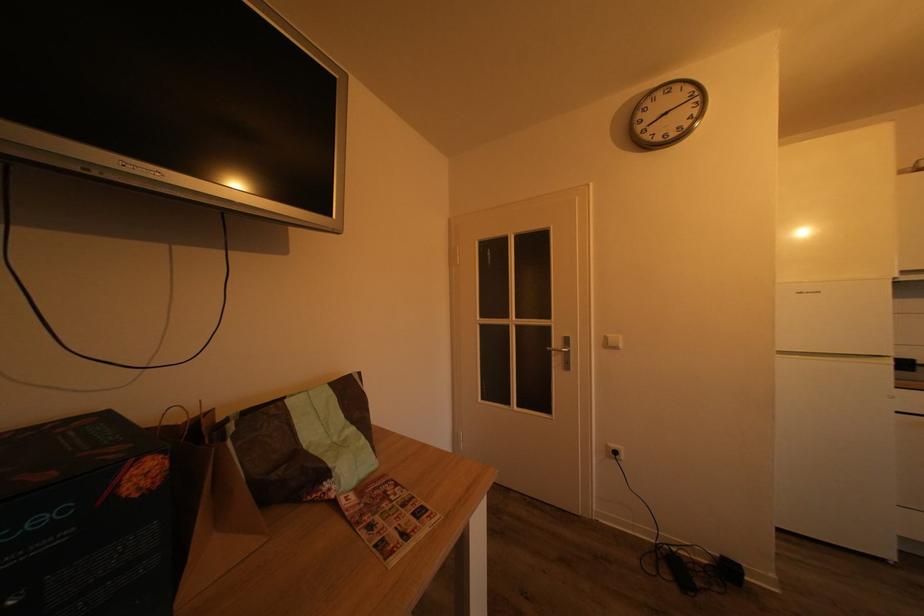
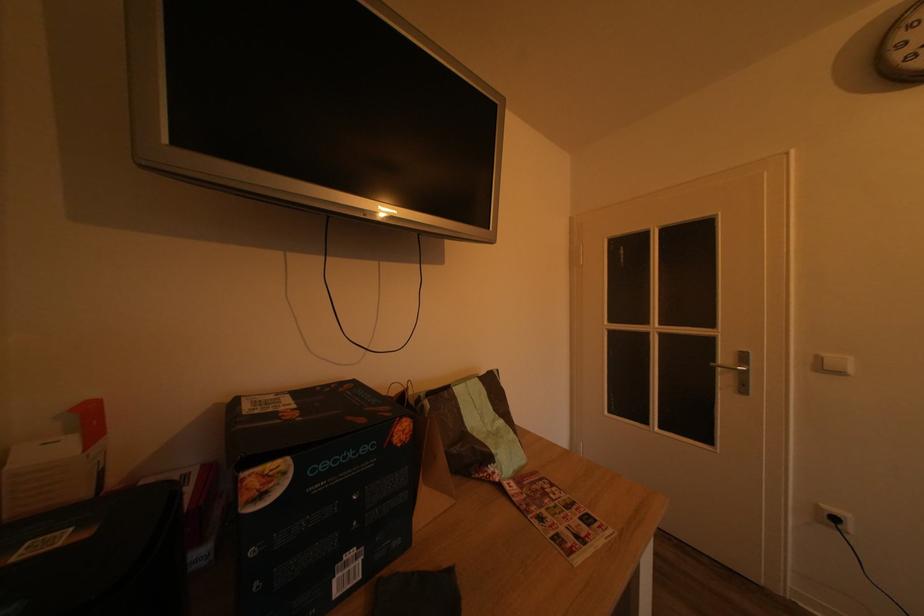
Question: I am providing you with two images of the same scene from different viewpoints. Please identify which objects are invisible in image2.

Choices:
 (A) white light switch
 (B) black power plug
 (C) silver door handle
 (D) none of these

Answer: (D)